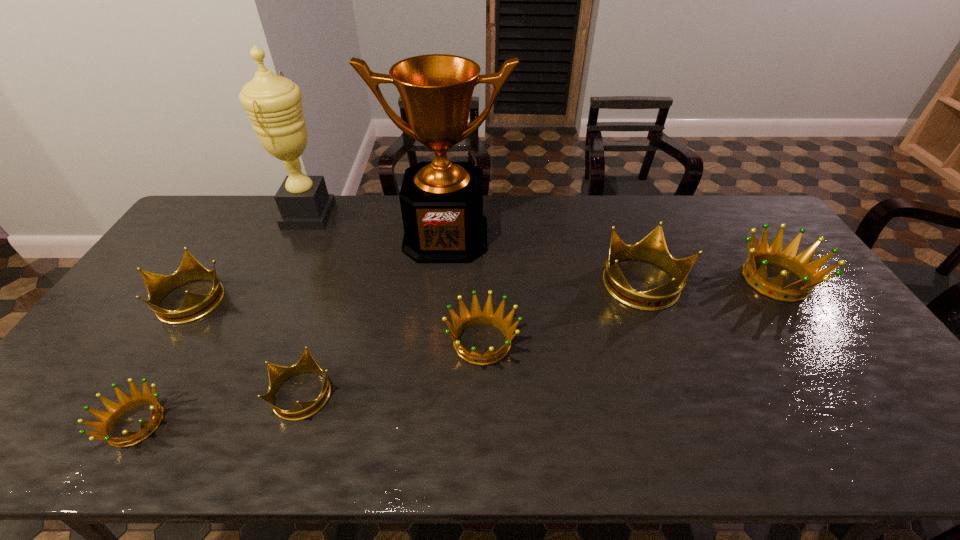
Locate which object ranks third in proximity to the sixth object from right to left. Please provide its 2D coordinates. Your answer should be formatted as a tuple, i.e. [(x, y)], where the tuple contains the x and y coordinates of a point satisfying the conditions above.

[(278, 375)]

The image size is (960, 540). Identify the location of crown that is the second closest to the second nearest golden crown. (653, 249).

Choose which crown is the second nearest neighbor to the shortest object. Please provide its 2D coordinates. Your answer should be formatted as a tuple, i.e. [(x, y)], where the tuple contains the x and y coordinates of a point satisfying the conditions above.

[(195, 306)]

Identify which gold crown is the third nearest to the shortest object. Please provide its 2D coordinates. Your answer should be formatted as a tuple, i.e. [(x, y)], where the tuple contains the x and y coordinates of a point satisfying the conditions above.

[(653, 249)]

Identify which gold crown is the nearest to the rightmost object. Please provide its 2D coordinates. Your answer should be formatted as a tuple, i.e. [(x, y)], where the tuple contains the x and y coordinates of a point satisfying the conditions above.

[(653, 249)]

Where is `golden crown that can be found as the third closest to the second object from right to left`? golden crown that can be found as the third closest to the second object from right to left is located at coordinates (126, 403).

Locate which golden crown ranks second in proximity to the second smallest golden crown. Please provide its 2D coordinates. Your answer should be formatted as a tuple, i.e. [(x, y)], where the tuple contains the x and y coordinates of a point satisfying the conditions above.

[(809, 273)]

Locate an element on the screen. The width and height of the screenshot is (960, 540). free space that satisfies the following two spatial constraints: 1. at the front of the biggest golden crown with handles; 2. on the right side of the left trophy cup is located at coordinates (279, 280).

Where is `free spot that satisfies the following two spatial constraints: 1. on the back side of the rightmost object; 2. on the right side of the second gold crown from left to right`? The image size is (960, 540). free spot that satisfies the following two spatial constraints: 1. on the back side of the rightmost object; 2. on the right side of the second gold crown from left to right is located at coordinates 341,280.

At what (x,y) coordinates should I click in order to perform the action: click on vacant area that satisfies the following two spatial constraints: 1. on the back side of the rightmost crown; 2. at the front of the sixth object from right to left with handles. Please return your answer as a coordinate pair (x, y). This screenshot has height=540, width=960. Looking at the image, I should click on (732, 215).